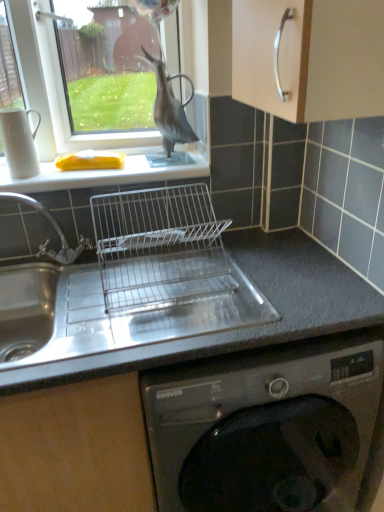
Question: Is matte black bird at upper center not near smooth gray countertop at center?

Choices:
 (A) yes
 (B) no

Answer: (B)

Question: Considering the relative sizes of matte black bird at upper center and smooth gray countertop at center in the image provided, is matte black bird at upper center shorter than smooth gray countertop at center?

Choices:
 (A) yes
 (B) no

Answer: (A)

Question: Is matte black bird at upper center positioned with its back to smooth gray countertop at center?

Choices:
 (A) yes
 (B) no

Answer: (B)

Question: From a real-world perspective, is matte black bird at upper center below smooth gray countertop at center?

Choices:
 (A) yes
 (B) no

Answer: (B)

Question: Is matte black bird at upper center closer to camera compared to smooth gray countertop at center?

Choices:
 (A) yes
 (B) no

Answer: (B)

Question: From the image's perspective, is clear glass window at upper left positioned above or below white matte sponge at upper left?

Choices:
 (A) above
 (B) below

Answer: (A)

Question: In the image, is clear glass window at upper left on the left side or the right side of white matte sponge at upper left?

Choices:
 (A) right
 (B) left

Answer: (B)

Question: Looking at their shapes, would you say clear glass window at upper left is wider or thinner than white matte sponge at upper left?

Choices:
 (A) wide
 (B) thin

Answer: (B)

Question: Does point (96, 133) appear closer or farther from the camera than point (19, 182)?

Choices:
 (A) closer
 (B) farther

Answer: (B)

Question: Based on their sizes in the image, would you say matte black bird at upper center is bigger or smaller than smooth gray countertop at center?

Choices:
 (A) big
 (B) small

Answer: (B)

Question: Considering the positions of matte black bird at upper center and smooth gray countertop at center in the image, is matte black bird at upper center wider or thinner than smooth gray countertop at center?

Choices:
 (A) thin
 (B) wide

Answer: (A)

Question: Considering the positions of matte black bird at upper center and smooth gray countertop at center in the image, is matte black bird at upper center taller or shorter than smooth gray countertop at center?

Choices:
 (A) short
 (B) tall

Answer: (A)

Question: Is matte black bird at upper center spatially inside smooth gray countertop at center, or outside of it?

Choices:
 (A) outside
 (B) inside

Answer: (A)

Question: Is clear glass window at upper left taller or shorter than smooth gray countertop at center?

Choices:
 (A) short
 (B) tall

Answer: (A)

Question: Considering the positions of clear glass window at upper left and smooth gray countertop at center in the image, is clear glass window at upper left bigger or smaller than smooth gray countertop at center?

Choices:
 (A) small
 (B) big

Answer: (A)